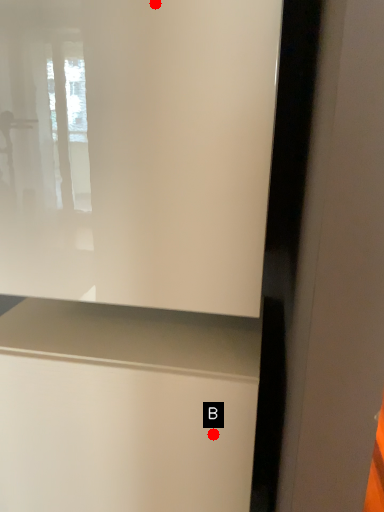
Question: Two points are circled on the image, labeled by A and B beside each circle. Which of the following is the closest to the observer?

Choices:
 (A) A is closer
 (B) B is closer

Answer: (A)